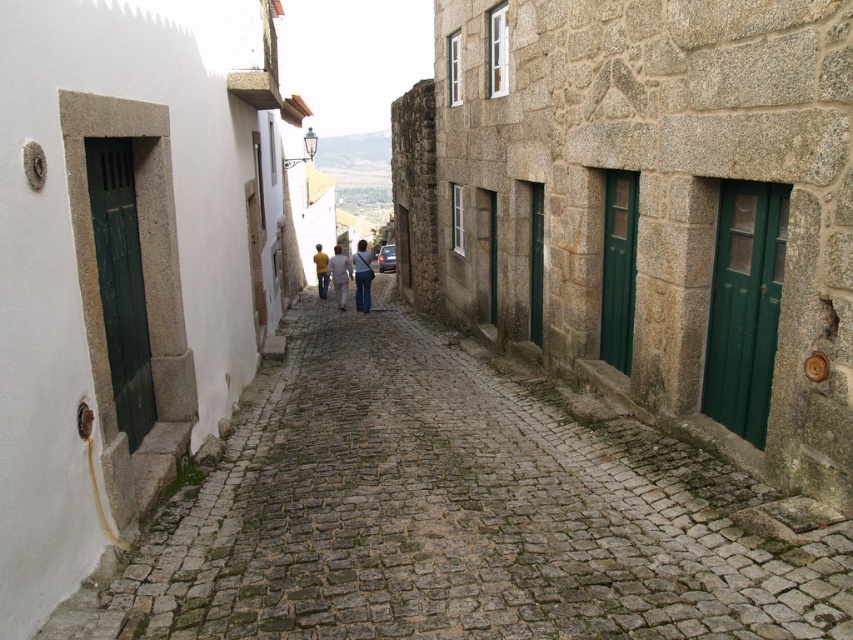
Question: Is brown cobblestone path at center closer to camera compared to yellow matte shirt at center?

Choices:
 (A) yes
 (B) no

Answer: (A)

Question: Does light yellow sweater at center have a greater width compared to yellow matte shirt at center?

Choices:
 (A) no
 (B) yes

Answer: (B)

Question: Can you confirm if brown cobblestone path at center is smaller than denim pants at center?

Choices:
 (A) no
 (B) yes

Answer: (B)

Question: Which object is closer to the camera taking this photo?

Choices:
 (A) light yellow sweater at center
 (B) yellow matte shirt at center

Answer: (A)

Question: Estimate the real-world distances between objects in this image. Which object is farther from the denim pants at center?

Choices:
 (A) yellow matte shirt at center
 (B) light yellow sweater at center
 (C) brown cobblestone path at center

Answer: (C)

Question: Among these points, which one is farthest from the camera?

Choices:
 (A) (366, 276)
 (B) (326, 269)
 (C) (717, 547)
 (D) (338, 284)

Answer: (B)